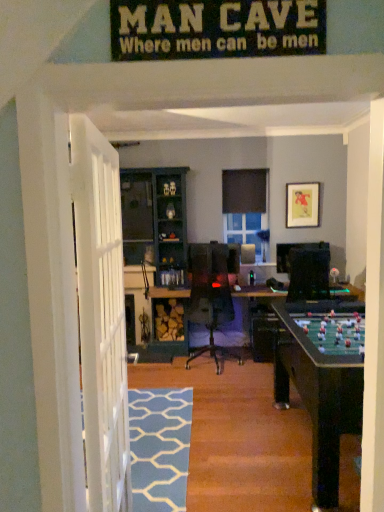
Where is `vacant point above green felt table at center (from a real-world perspective)`? This screenshot has width=384, height=512. vacant point above green felt table at center (from a real-world perspective) is located at coordinates coord(185,403).